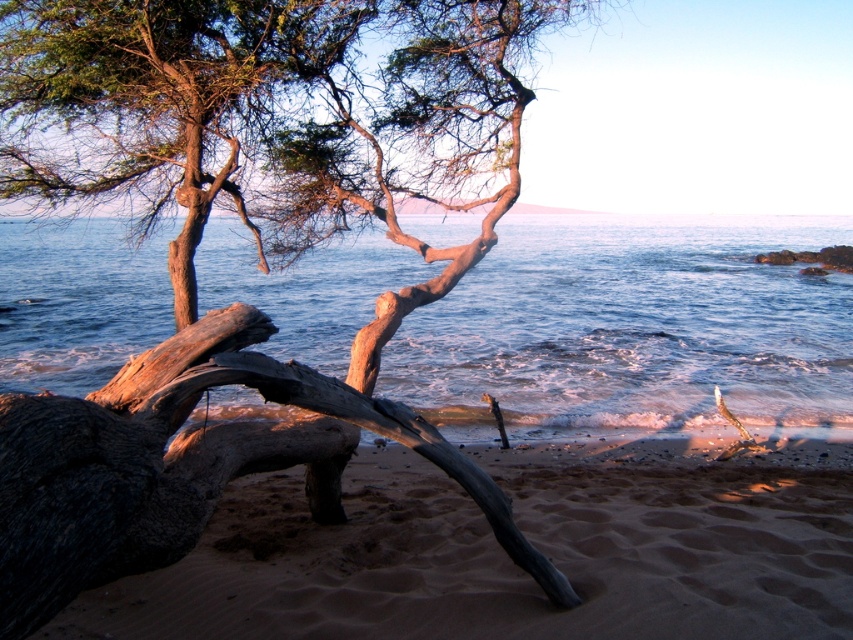
Who is more distant from viewer, [32,433] or [811,317]?

The point [811,317] is more distant.

This screenshot has height=640, width=853. I want to click on smooth brown driftwood at lower left, so click(x=254, y=244).

Does point (148, 452) come closer to viewer compared to point (589, 346)?

That is True.

Locate an element on the screen. Image resolution: width=853 pixels, height=640 pixels. smooth brown driftwood at lower left is located at coordinates (254, 244).

Which of these two, blue water at center or sandy brown at lower left, stands shorter?

sandy brown at lower left is shorter.

Does blue water at center have a lesser height compared to sandy brown at lower left?

Incorrect, blue water at center's height does not fall short of sandy brown at lower left's.

Image resolution: width=853 pixels, height=640 pixels. Describe the element at coordinates (633, 326) in the screenshot. I see `blue water at center` at that location.

Identify the location of blue water at center. (633, 326).

Does smooth brown driftwood at lower left have a greater width compared to sandy brown at lower left?

Incorrect, smooth brown driftwood at lower left's width does not surpass sandy brown at lower left's.

Measure the distance between point (x=492, y=51) and camera.

5.86 meters

Who is more distant from viewer, (x=292, y=237) or (x=567, y=618)?

The point (x=292, y=237) is more distant.

I want to click on smooth brown driftwood at lower left, so click(254, 244).